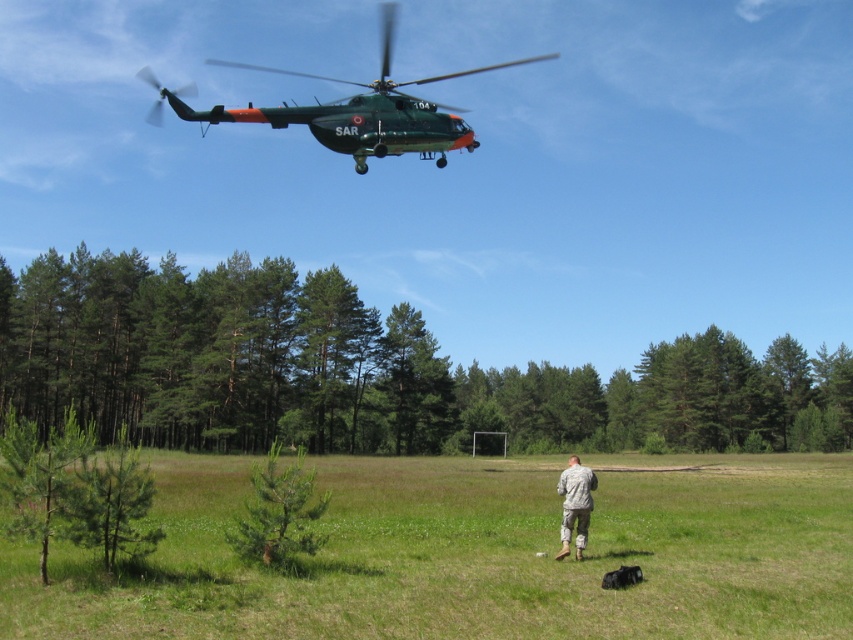
Between green grass at center and black fur dog at lower center, which one has more height?

green grass at center is taller.

Who is shorter, green grass at center or black fur dog at lower center?

Standing shorter between the two is black fur dog at lower center.

This screenshot has height=640, width=853. I want to click on green grass at center, so click(x=473, y=554).

Image resolution: width=853 pixels, height=640 pixels. Identify the location of green grass at center. (473, 554).

Is point (218, 108) closer to viewer compared to point (576, 541)?

No, it is behind (576, 541).

Is green matte helicopter at upper center to the left of camouflage uniform at center from the viewer's perspective?

Yes, green matte helicopter at upper center is to the left of camouflage uniform at center.

What do you see at coordinates (351, 109) in the screenshot?
I see `green matte helicopter at upper center` at bounding box center [351, 109].

The width and height of the screenshot is (853, 640). What are the coordinates of `green matte helicopter at upper center` in the screenshot? It's located at (351, 109).

Between point (572, 508) and point (608, 572), which one is positioned in front?

Point (608, 572) is in front.

What do you see at coordinates (575, 504) in the screenshot?
I see `camouflage uniform at center` at bounding box center [575, 504].

Does point (579, 515) come behind point (606, 582)?

Yes, it is.

Where is `camouflage uniform at center`? camouflage uniform at center is located at coordinates (x=575, y=504).